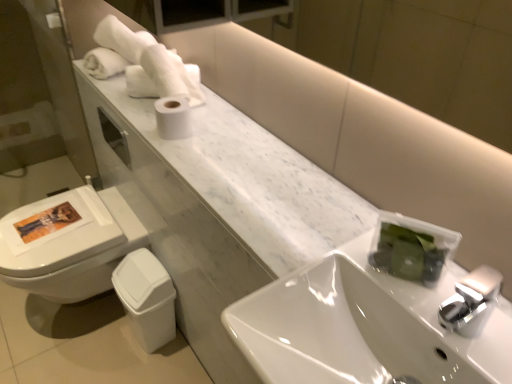
Question: Is the depth of white marble counter at upper left less than that of white matte toilet paper at center?

Choices:
 (A) no
 (B) yes

Answer: (B)

Question: Is white marble counter at upper left taller than white matte toilet paper at center?

Choices:
 (A) no
 (B) yes

Answer: (A)

Question: Is white marble counter at upper left located outside white matte toilet paper at center?

Choices:
 (A) yes
 (B) no

Answer: (A)

Question: Can you confirm if white marble counter at upper left is positioned to the left of white matte toilet paper at center?

Choices:
 (A) no
 (B) yes

Answer: (A)

Question: Is white marble counter at upper left not near white matte toilet paper at center?

Choices:
 (A) no
 (B) yes

Answer: (A)

Question: From the image's perspective, would you say white marble counter at upper left is positioned over white matte toilet paper at center?

Choices:
 (A) no
 (B) yes

Answer: (A)

Question: From the image's perspective, is white soft towel at upper left over white glossy sink at center?

Choices:
 (A) no
 (B) yes

Answer: (B)

Question: Can you confirm if white soft towel at upper left is thinner than white glossy sink at center?

Choices:
 (A) yes
 (B) no

Answer: (A)

Question: Is white soft towel at upper left oriented away from white glossy sink at center?

Choices:
 (A) no
 (B) yes

Answer: (A)

Question: From the image's perspective, is white soft towel at upper left beneath white glossy sink at center?

Choices:
 (A) yes
 (B) no

Answer: (B)

Question: Does white soft towel at upper left have a lesser height compared to white glossy sink at center?

Choices:
 (A) no
 (B) yes

Answer: (A)

Question: Is white soft towel at upper left far from white glossy sink at center?

Choices:
 (A) yes
 (B) no

Answer: (B)

Question: From the image's perspective, does white soft towel at upper left appear higher than white matte toilet paper at center?

Choices:
 (A) yes
 (B) no

Answer: (A)